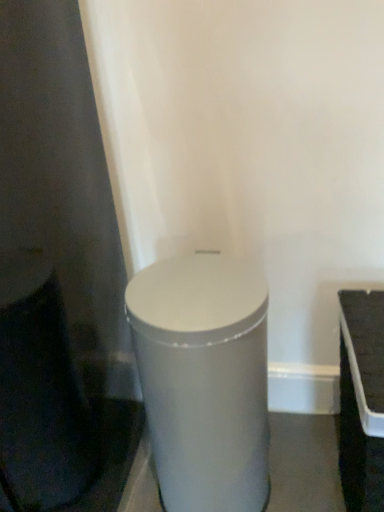
Question: Is satin silver cylinder at center turned away from white plastic tray at right?

Choices:
 (A) no
 (B) yes

Answer: (A)

Question: Is white plastic tray at right inside satin silver cylinder at center?

Choices:
 (A) no
 (B) yes

Answer: (A)

Question: Does satin silver cylinder at center have a greater height compared to white plastic tray at right?

Choices:
 (A) no
 (B) yes

Answer: (B)

Question: Can we say satin silver cylinder at center lies outside white plastic tray at right?

Choices:
 (A) yes
 (B) no

Answer: (A)

Question: Is there a large distance between satin silver cylinder at center and white plastic tray at right?

Choices:
 (A) yes
 (B) no

Answer: (B)

Question: Is satin silver cylinder at center to the left of white plastic tray at right from the viewer's perspective?

Choices:
 (A) no
 (B) yes

Answer: (B)

Question: Is white plastic tray at right to the left of satin silver cylinder at center from the viewer's perspective?

Choices:
 (A) no
 (B) yes

Answer: (A)

Question: Can you confirm if white plastic tray at right is taller than satin silver cylinder at center?

Choices:
 (A) no
 (B) yes

Answer: (A)

Question: Considering the relative sizes of white plastic tray at right and satin silver cylinder at center in the image provided, is white plastic tray at right shorter than satin silver cylinder at center?

Choices:
 (A) no
 (B) yes

Answer: (B)

Question: From the image's perspective, does white plastic tray at right appear lower than satin silver cylinder at center?

Choices:
 (A) yes
 (B) no

Answer: (A)

Question: From a real-world perspective, is white plastic tray at right located higher than satin silver cylinder at center?

Choices:
 (A) no
 (B) yes

Answer: (A)

Question: Is white plastic tray at right closer to the viewer compared to satin silver cylinder at center?

Choices:
 (A) no
 (B) yes

Answer: (B)

Question: Looking at the image, does white plastic tray at right seem bigger or smaller compared to satin silver cylinder at center?

Choices:
 (A) small
 (B) big

Answer: (A)